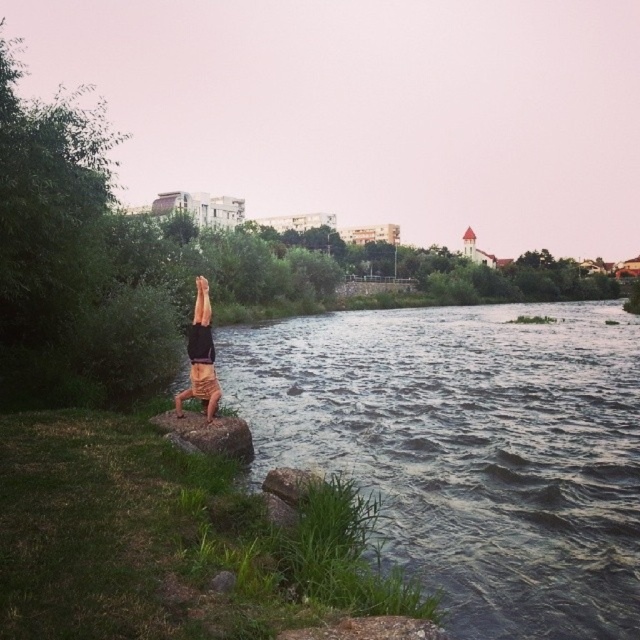
You are a photographer trying to capture the perfect shot of the dark gray water at center and the tan shorts at center. Based on their positions, which object appears taller in the frame?

The dark gray water at center appears taller than the tan shorts at center in the frame.

You are a photographer standing at the riverside. You want to capture a photo of the tan shorts at center and the dark gray water at center in the same frame. Given that your camera has a maximum focus range of 20 meters, will both objects be in focus?

The dark gray water at center and tan shorts at center are 20.03 meters apart from each other. Since the distance between them exceeds the camera maximum focus range of 20 meters, both objects cannot be in focus at the same time.

You are a photographer trying to capture the perfect shot of the person doing a handstand. Based on the scene, is the dark gray water at center closer to the camera than the tan shorts at center?

The dark gray water at center is located above the tan shorts at center, which means it is closer to the camera since objects higher in the image are typically nearer in such compositions.